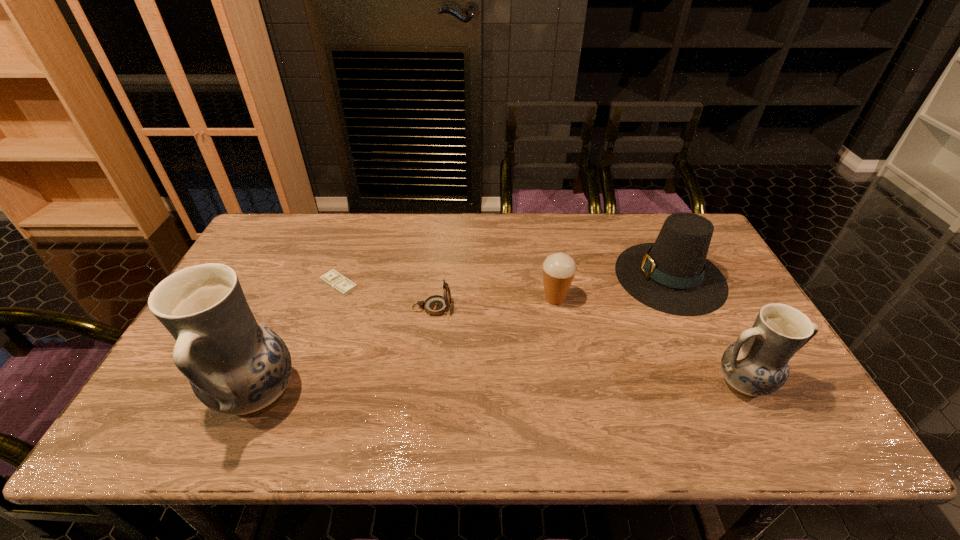
To make them evenly spaced by inserting another pottery among them, please locate a vacant spot for this new pottery. Please provide its 2D coordinates. Your answer should be formatted as a tuple, i.e. [(x, y)], where the tuple contains the x and y coordinates of a point satisfying the conditions above.

[(503, 389)]